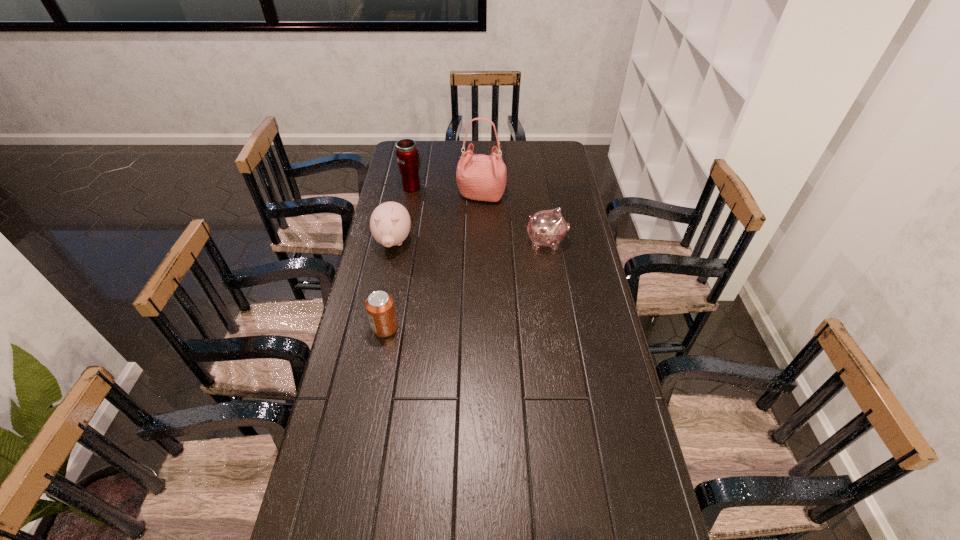
You are a GUI agent. You are given a task and a screenshot of the screen. Output one action in this format:
    pyautogui.click(x=<x>, y=<y>)
    Task: Click on the empty space that is in between the left piggy bank and the fourth object from left to right
    This screenshot has height=540, width=960.
    Given the screenshot: What is the action you would take?
    pyautogui.click(x=438, y=219)

Locate an element on the screen. Image resolution: width=960 pixels, height=540 pixels. vacant area that lies between the thermos bottle and the rightmost object is located at coordinates (479, 214).

The image size is (960, 540). Find the location of `free space that is in between the rightmost object and the can`. free space that is in between the rightmost object and the can is located at coordinates (466, 285).

Find the location of `object identified as the fourth closest to the can`. object identified as the fourth closest to the can is located at coordinates (409, 159).

Point out which object is positioned as the fourth nearest to the right piggy bank. Please provide its 2D coordinates. Your answer should be formatted as a tuple, i.e. [(x, y)], where the tuple contains the x and y coordinates of a point satisfying the conditions above.

[(380, 307)]

Identify which piggy bank is the closest to the second tallest object. Please provide its 2D coordinates. Your answer should be formatted as a tuple, i.e. [(x, y)], where the tuple contains the x and y coordinates of a point satisfying the conditions above.

[(390, 223)]

This screenshot has height=540, width=960. I want to click on piggy bank identified as the second closest to the nearest object, so click(x=548, y=228).

Where is `vacant point that satisfies the following two spatial constraints: 1. on the front facing side of the rightmost object; 2. at the snout of the left piggy bank`? vacant point that satisfies the following two spatial constraints: 1. on the front facing side of the rightmost object; 2. at the snout of the left piggy bank is located at coordinates (546, 242).

Image resolution: width=960 pixels, height=540 pixels. Find the location of `free region that satisfies the following two spatial constraints: 1. at the snout of the left piggy bank; 2. on the front facing side of the right piggy bank`. free region that satisfies the following two spatial constraints: 1. at the snout of the left piggy bank; 2. on the front facing side of the right piggy bank is located at coordinates (394, 242).

You are a GUI agent. You are given a task and a screenshot of the screen. Output one action in this format:
    pyautogui.click(x=<x>, y=<y>)
    Task: Click on the free space that satisfies the following two spatial constraints: 1. on the front side of the tallest object; 2. on the front facing side of the right piggy bank
    
    Given the screenshot: What is the action you would take?
    pyautogui.click(x=482, y=242)